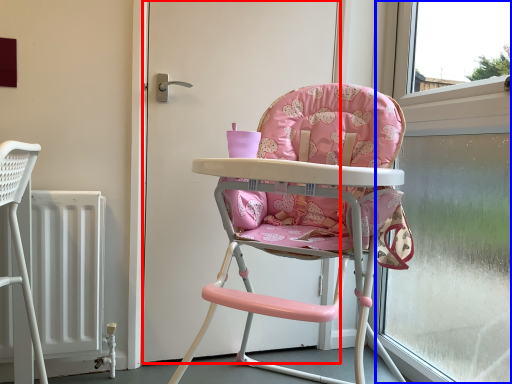
Question: Which of the following is the closest to the observer, door (highlighted by a red box) or window frame (highlighted by a blue box)?

Choices:
 (A) door
 (B) window frame

Answer: (B)